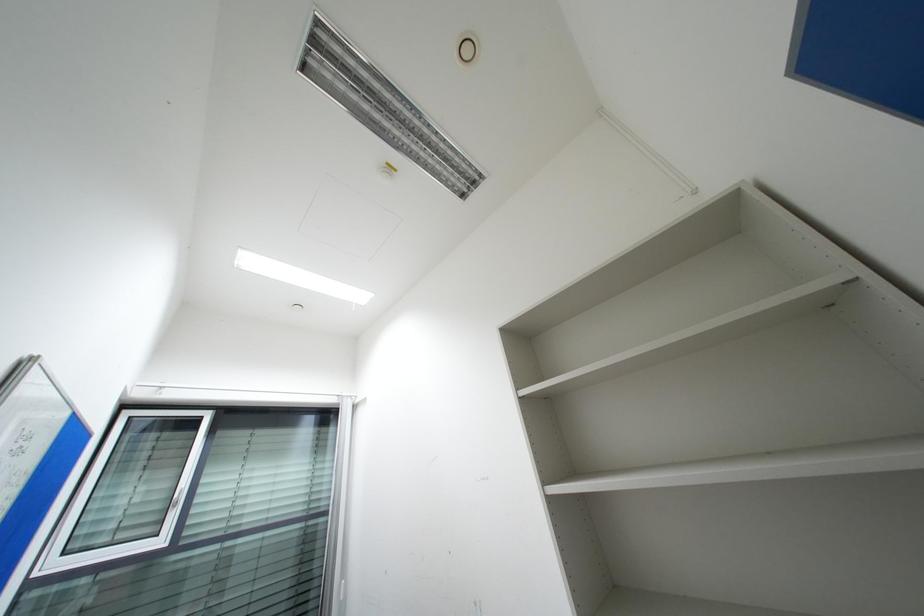
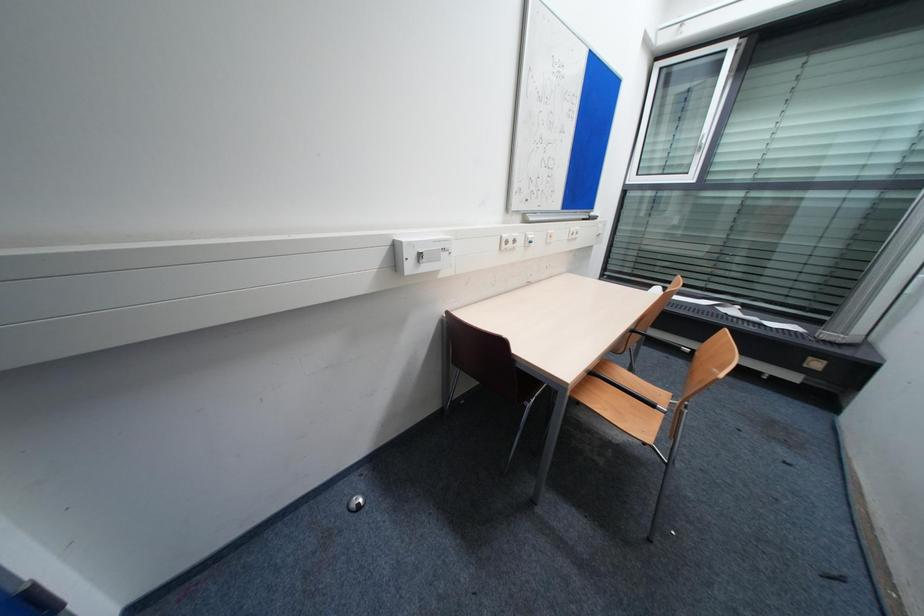
First-person continuous shooting, in which direction is the camera rotating?

The camera's rotation is toward left-down.